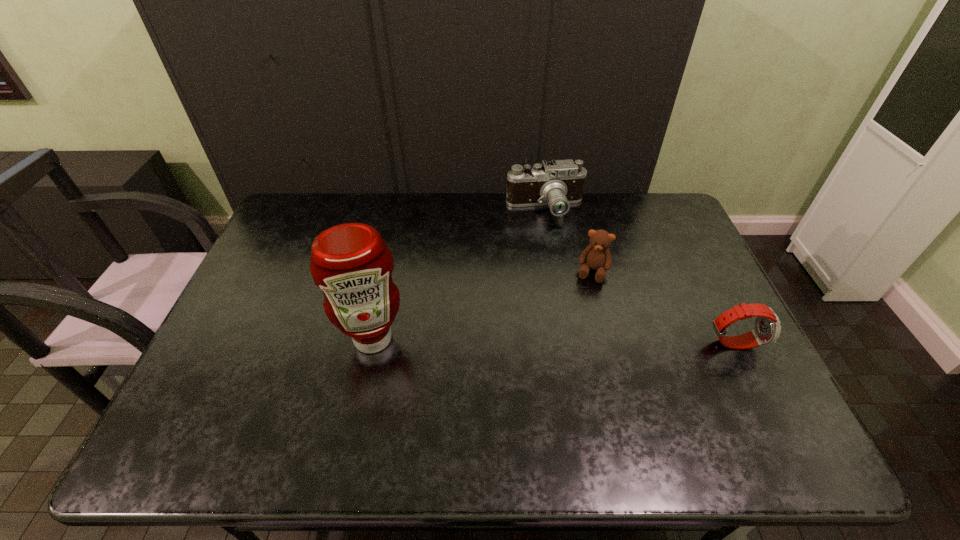
This screenshot has width=960, height=540. In order to click on free region located 0.270m at the lens of the camera in this screenshot , I will do `click(554, 280)`.

I want to click on free space located 0.180m at the lens of the camera, so click(551, 259).

Where is `object positioned at the far edge`? object positioned at the far edge is located at coordinates (558, 183).

This screenshot has width=960, height=540. Identify the location of object present at the right edge. (766, 329).

In order to click on free space at the far edge of the desktop in this screenshot , I will do `click(546, 231)`.

Where is `free space at the left edge of the desktop`? The image size is (960, 540). free space at the left edge of the desktop is located at coordinates (279, 269).

Find the location of a particular element. This screenshot has width=960, height=540. free space at the right edge of the desktop is located at coordinates (691, 319).

This screenshot has width=960, height=540. In the image, there is a desktop. Identify the location of vacant space at the far left corner. (303, 225).

This screenshot has height=540, width=960. I want to click on vacant space at the near left corner, so click(227, 413).

The image size is (960, 540). In order to click on vacant area at the far right corner of the desktop in this screenshot , I will do `click(647, 194)`.